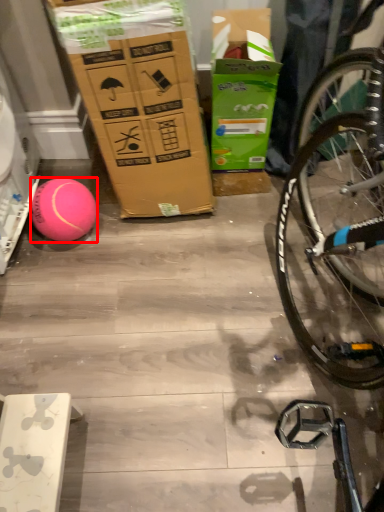
Question: From the image's perspective, what is the correct spatial positioning of ball (annotated by the red box) in reference to cardboard box?

Choices:
 (A) above
 (B) below

Answer: (B)